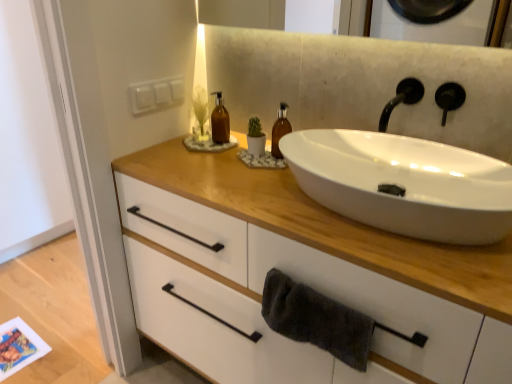
Question: Looking at their shapes, would you say dark gray towel at lower center is wider or thinner than translucent amber bottle at center, which is the second bottle in left-to-right order?

Choices:
 (A) thin
 (B) wide

Answer: (A)

Question: Visually, is dark gray towel at lower center positioned to the left or to the right of translucent amber bottle at center, which is the second bottle in left-to-right order?

Choices:
 (A) right
 (B) left

Answer: (A)

Question: Considering the real-world distances, which object is closest to the dark gray towel at lower center?

Choices:
 (A) white matte cabinet at center
 (B) translucent amber bottle at center, which is the second bottle in left-to-right order
 (C) brown glass bottle at center, acting as the second bottle starting from the right
 (D) white ceramic sink at center
 (E) black matte tap at upper right

Answer: (A)

Question: Which object is the farthest from the translucent amber bottle at center, the first bottle when ordered from right to left?

Choices:
 (A) brown glass bottle at center, the first bottle viewed from the left
 (B) white ceramic sink at center
 (C) black matte tap at upper right
 (D) white matte cabinet at center
 (E) dark gray towel at lower center

Answer: (E)